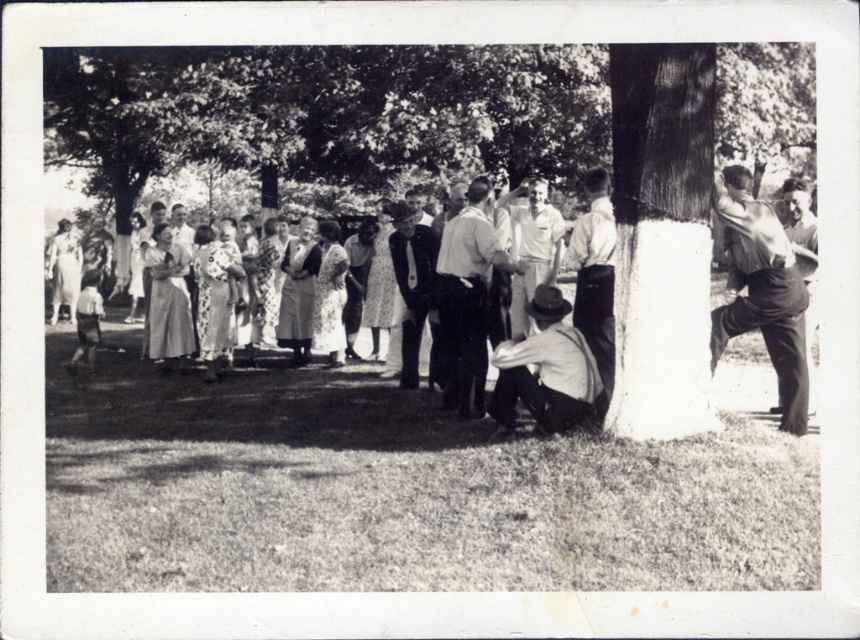
Question: In this image, where is smooth bark tree at center located relative to smooth white shirt at center?

Choices:
 (A) below
 (B) above

Answer: (B)

Question: From the image, what is the correct spatial relationship of smooth bark tree at center in relation to smooth brown shirt at right?

Choices:
 (A) below
 (B) above

Answer: (B)

Question: Based on their relative distances, which object is nearer to the matte brown hat at lower center?

Choices:
 (A) smooth black suit at center
 (B) smooth brown suit at right

Answer: (B)

Question: Which of these objects is positioned farthest from the matte brown hat at lower center?

Choices:
 (A) smooth white shirt at center
 (B) smooth brown shirt at right
 (C) smooth bark tree at center

Answer: (C)

Question: Which point is farther to the camera?

Choices:
 (A) floral dress at center
 (B) smooth white shirt at center
 (C) smooth black suit at center

Answer: (C)

Question: Observing the image, what is the correct spatial positioning of smooth bark tree at center in reference to smooth brown suit at right?

Choices:
 (A) above
 (B) below

Answer: (A)